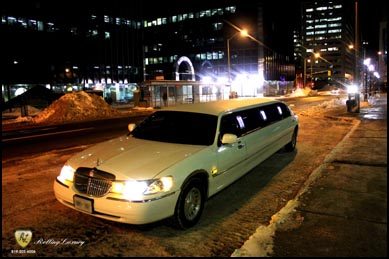
Find the location of `trash can`. trash can is located at coordinates (351, 104).